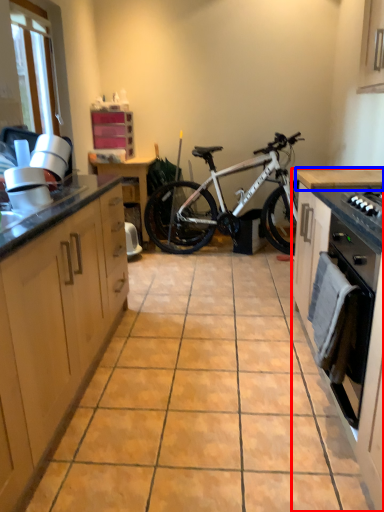
Question: Among these objects, which one is nearest to the camera, cabinetry (highlighted by a red box) or counter top (highlighted by a blue box)?

Choices:
 (A) cabinetry
 (B) counter top

Answer: (A)